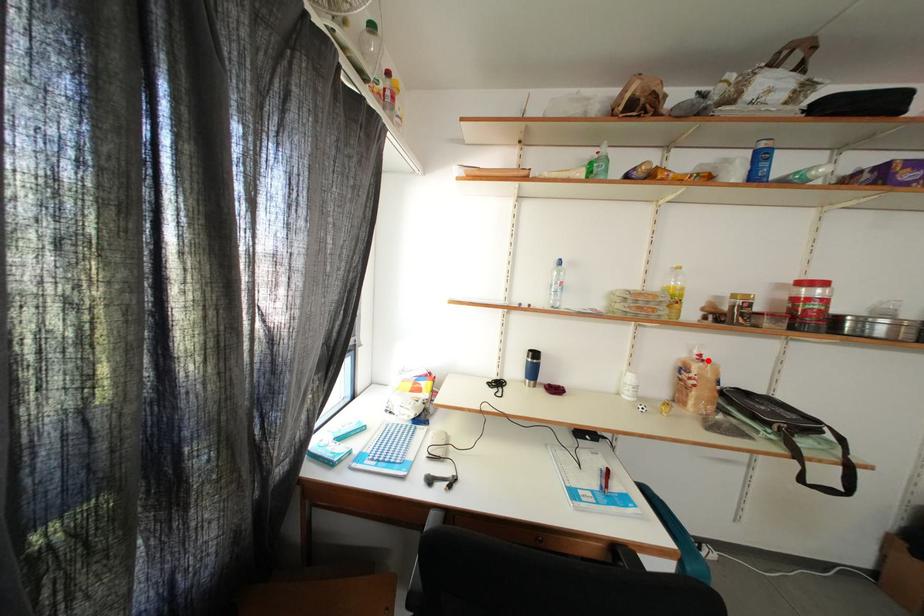
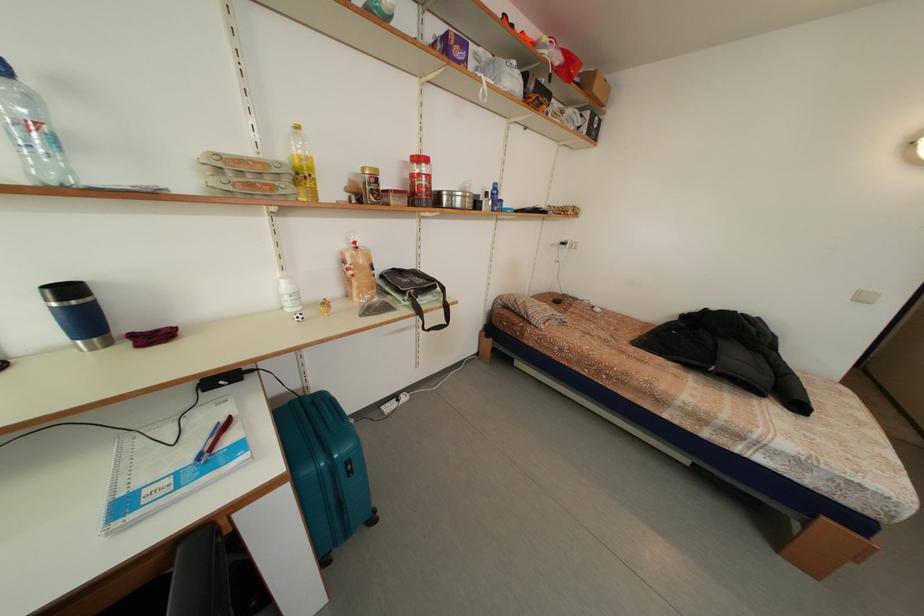
Question: A red point is marked in image1. In image2, is the corresponding 3D point closer to the camera or farther? Reply with the corresponding letter.

Choices:
 (A) The corresponding 3D point is closer.
 (B) The corresponding 3D point is farther.

Answer: (A)